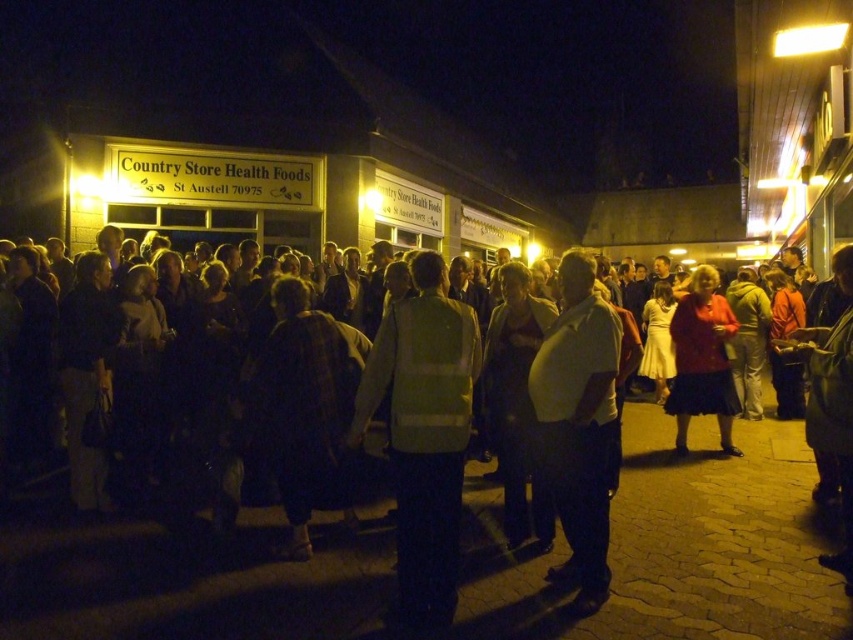
Can you confirm if white matte shirt at center is taller than matte red coat at center?

Indeed, white matte shirt at center has a greater height compared to matte red coat at center.

Who is more distant from viewer, (608,323) or (682,435)?

Positioned behind is point (682,435).

This screenshot has height=640, width=853. Identify the location of white matte shirt at center. (578, 422).

Does dark clothing crowd at center have a smaller size compared to matte red coat at center?

Yes, dark clothing crowd at center is smaller than matte red coat at center.

Is dark clothing crowd at center bigger than matte red coat at center?

No, dark clothing crowd at center is not bigger than matte red coat at center.

This screenshot has height=640, width=853. Find the location of `dark clothing crowd at center`. dark clothing crowd at center is located at coordinates (672, 547).

Between reflective yellow vest at center and matte red coat at center, which one appears on the right side from the viewer's perspective?

Positioned to the right is matte red coat at center.

Does point (405, 420) come in front of point (730, 433)?

That is True.

Locate an element on the screen. Image resolution: width=853 pixels, height=640 pixels. reflective yellow vest at center is located at coordinates (424, 433).